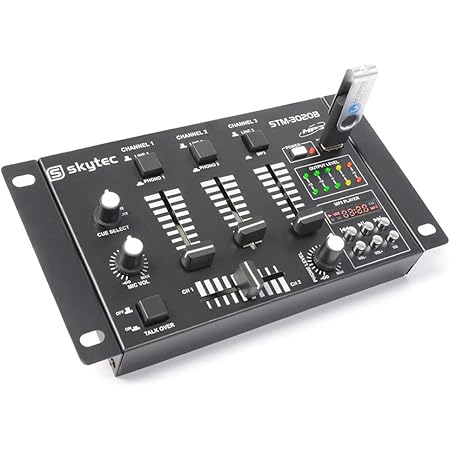
Where is `silver knob`? The width and height of the screenshot is (450, 450). silver knob is located at coordinates (372, 228).